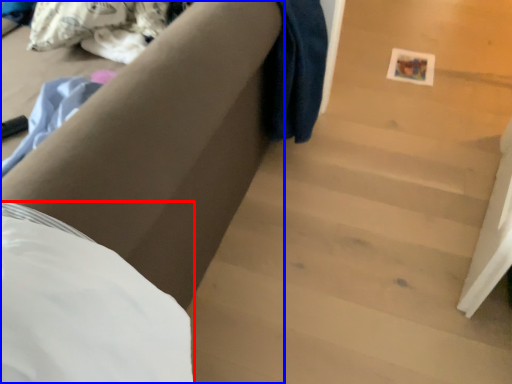
Question: Which of the following is the closest to the observer, sheet (highlighted by a red box) or furniture (highlighted by a blue box)?

Choices:
 (A) sheet
 (B) furniture

Answer: (A)